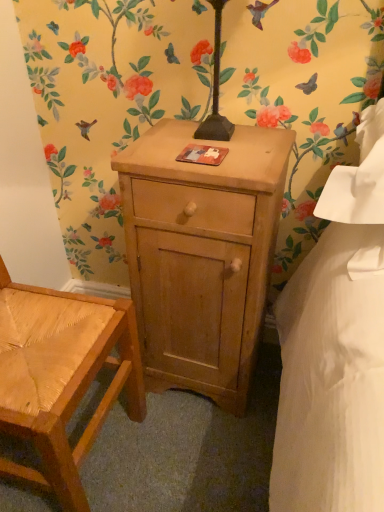
Question: Does natural wood nightstand at center have a lesser width compared to woven wood chair at lower left?

Choices:
 (A) yes
 (B) no

Answer: (A)

Question: Can you confirm if natural wood nightstand at center is shorter than woven wood chair at lower left?

Choices:
 (A) yes
 (B) no

Answer: (A)

Question: Is natural wood nightstand at center positioned before woven wood chair at lower left?

Choices:
 (A) no
 (B) yes

Answer: (A)

Question: Is natural wood nightstand at center located outside woven wood chair at lower left?

Choices:
 (A) no
 (B) yes

Answer: (B)

Question: From a real-world perspective, is natural wood nightstand at center on woven wood chair at lower left?

Choices:
 (A) yes
 (B) no

Answer: (B)

Question: Can you confirm if natural wood nightstand at center is smaller than woven wood chair at lower left?

Choices:
 (A) yes
 (B) no

Answer: (A)

Question: From the image's perspective, is woven wood chair at lower left beneath natural wood nightstand at center?

Choices:
 (A) no
 (B) yes

Answer: (B)

Question: Is woven wood chair at lower left directly adjacent to natural wood nightstand at center?

Choices:
 (A) no
 (B) yes

Answer: (A)

Question: Is woven wood chair at lower left bigger than natural wood nightstand at center?

Choices:
 (A) yes
 (B) no

Answer: (A)

Question: From the image's perspective, is woven wood chair at lower left above natural wood nightstand at center?

Choices:
 (A) no
 (B) yes

Answer: (A)

Question: From a real-world perspective, is woven wood chair at lower left under natural wood nightstand at center?

Choices:
 (A) no
 (B) yes

Answer: (A)

Question: From a real-world perspective, is woven wood chair at lower left over natural wood nightstand at center?

Choices:
 (A) yes
 (B) no

Answer: (A)

Question: Relative to woven wood chair at lower left, is natural wood nightstand at center in front or behind?

Choices:
 (A) front
 (B) behind

Answer: (B)